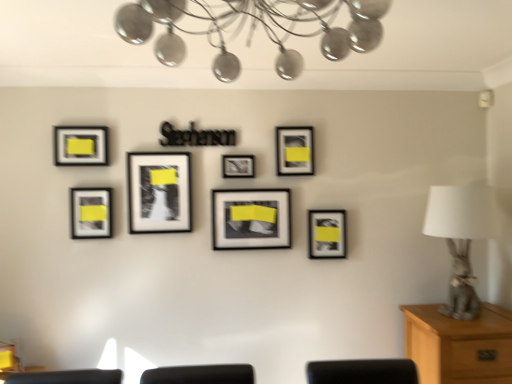
Question: Does matte black picture frame at lower left, which appears as the 6th picture frame when viewed from the right, have a smaller size compared to matte black picture frame at upper left, which is the 7th picture frame in right-to-left order?

Choices:
 (A) yes
 (B) no

Answer: (B)

Question: From a real-world perspective, is matte black picture frame at lower left, which ranks as the second picture frame in left-to-right order, physically below matte black picture frame at upper left, which is the 7th picture frame in right-to-left order?

Choices:
 (A) no
 (B) yes

Answer: (B)

Question: Is matte black picture frame at lower left, which ranks as the second picture frame in left-to-right order, oriented towards matte black picture frame at upper left, which is the first picture frame from left to right?

Choices:
 (A) no
 (B) yes

Answer: (A)

Question: Is matte black picture frame at lower left, which ranks as the second picture frame in left-to-right order, at the right side of matte black picture frame at upper left, which is the 7th picture frame in right-to-left order?

Choices:
 (A) yes
 (B) no

Answer: (A)

Question: Is matte black picture frame at lower left, which ranks as the second picture frame in left-to-right order, looking in the opposite direction of matte black picture frame at upper left, which is the 7th picture frame in right-to-left order?

Choices:
 (A) yes
 (B) no

Answer: (B)

Question: Is matte black picture frame at lower left, which appears as the 6th picture frame when viewed from the right, wider than matte black picture frame at upper left, which is the 7th picture frame in right-to-left order?

Choices:
 (A) no
 (B) yes

Answer: (B)

Question: Is matte black picture frame at center, placed as the 4th picture frame when sorted from right to left, taller than matte black picture frame at upper left, which is the 7th picture frame in right-to-left order?

Choices:
 (A) yes
 (B) no

Answer: (B)

Question: Is matte black picture frame at center, marked as the fourth picture frame in a left-to-right arrangement, at the left side of matte black picture frame at upper left, which is the first picture frame from left to right?

Choices:
 (A) yes
 (B) no

Answer: (B)

Question: Is matte black picture frame at center, placed as the 4th picture frame when sorted from right to left, positioned in front of matte black picture frame at upper left, which is the 7th picture frame in right-to-left order?

Choices:
 (A) yes
 (B) no

Answer: (B)

Question: From a real-world perspective, does matte black picture frame at center, placed as the 4th picture frame when sorted from right to left, stand above matte black picture frame at upper left, which is the first picture frame from left to right?

Choices:
 (A) yes
 (B) no

Answer: (B)

Question: Considering the relative positions of matte black picture frame at center, marked as the fourth picture frame in a left-to-right arrangement, and matte black picture frame at upper left, which is the first picture frame from left to right, in the image provided, is matte black picture frame at center, marked as the fourth picture frame in a left-to-right arrangement, to the right of matte black picture frame at upper left, which is the first picture frame from left to right, from the viewer's perspective?

Choices:
 (A) yes
 (B) no

Answer: (A)

Question: From the image's perspective, would you say matte black picture frame at center, marked as the fourth picture frame in a left-to-right arrangement, is shown under matte black picture frame at upper left, which is the 7th picture frame in right-to-left order?

Choices:
 (A) no
 (B) yes

Answer: (B)

Question: From a real-world perspective, is matte black picture frame at lower left, which ranks as the second picture frame in left-to-right order, on matte black picture frame at center, the 3th picture frame from the right?

Choices:
 (A) yes
 (B) no

Answer: (A)